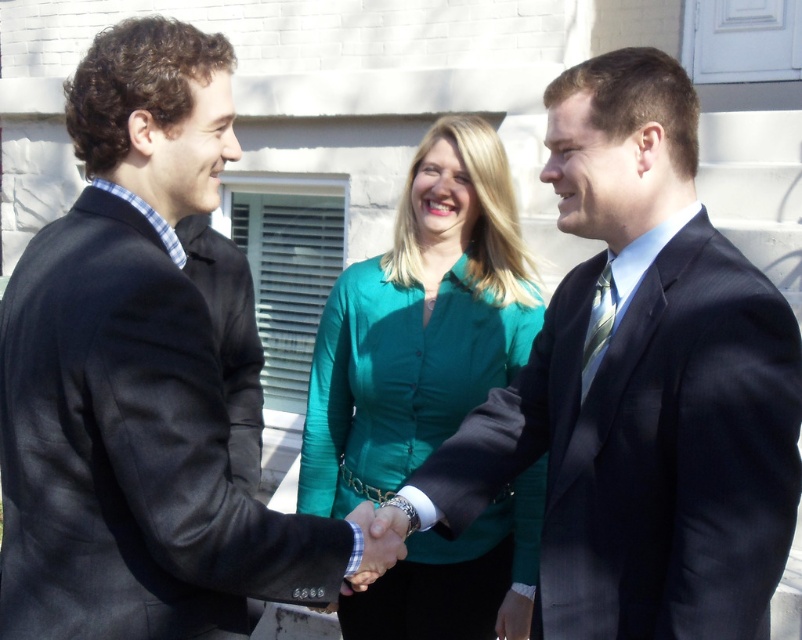
Question: Is matte black suit at center bigger than matte silver watch at center?

Choices:
 (A) yes
 (B) no

Answer: (A)

Question: Based on their relative distances, which object is farther from the matte silver watch at center?

Choices:
 (A) black suit at center
 (B) green silk blouse at center

Answer: (B)

Question: Which object is closer to the camera taking this photo?

Choices:
 (A) black suit at center
 (B) green silk blouse at center

Answer: (A)

Question: Which object is positioned closest to the black suit at center?

Choices:
 (A) matte black suit at center
 (B) matte silver watch at center

Answer: (B)

Question: Can you confirm if black suit at center is bigger than green silk blouse at center?

Choices:
 (A) no
 (B) yes

Answer: (A)

Question: Is black suit at center to the left of green silk blouse at center from the viewer's perspective?

Choices:
 (A) yes
 (B) no

Answer: (A)